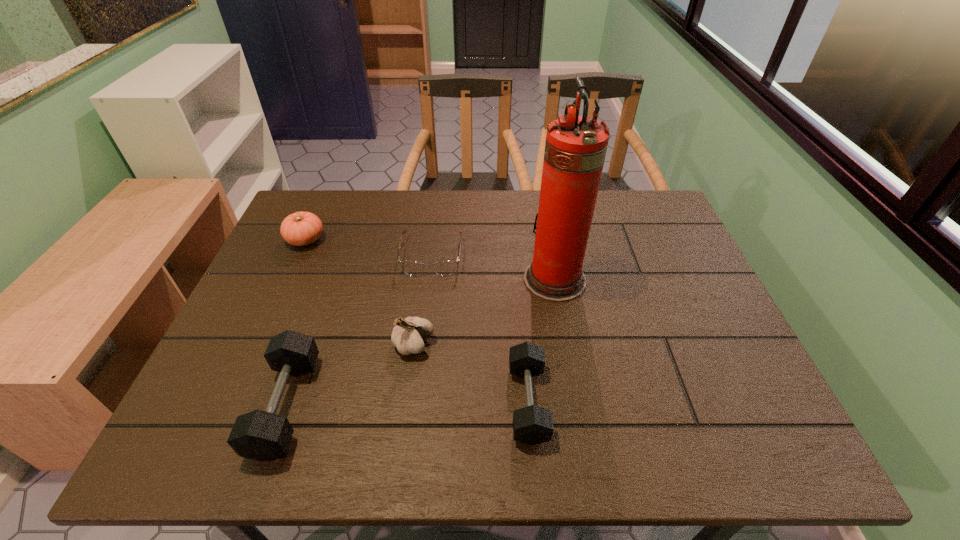
The image size is (960, 540). In order to click on vacant point located between the right dumbbell and the left dumbbell in this screenshot , I will do `click(407, 403)`.

You are a GUI agent. You are given a task and a screenshot of the screen. Output one action in this format:
    pyautogui.click(x=<x>, y=<y>)
    Task: Click on the blank region between the tomato and the tallest object
    The image size is (960, 540).
    Given the screenshot: What is the action you would take?
    pyautogui.click(x=430, y=260)

Where is `free space between the tallest object and the shortest object`? The image size is (960, 540). free space between the tallest object and the shortest object is located at coordinates (493, 268).

Locate an element on the screen. the third closest object to the garlic is located at coordinates (444, 268).

Identify the location of the fifth closest object relative to the shorter dumbbell. pyautogui.click(x=301, y=228).

Where is `vacant region that satisfies the following two spatial constraints: 1. on the front-facing side of the right dumbbell; 2. on the left side of the spectacles`? The width and height of the screenshot is (960, 540). vacant region that satisfies the following two spatial constraints: 1. on the front-facing side of the right dumbbell; 2. on the left side of the spectacles is located at coordinates (414, 402).

This screenshot has width=960, height=540. What are the coordinates of `free space that satisfies the following two spatial constraints: 1. at the discharge end of the tallest object; 2. on the front side of the garlic` in the screenshot? It's located at coord(565,344).

Locate an element on the screen. vacant space that satisfies the following two spatial constraints: 1. at the discharge end of the fire extinguisher; 2. on the front side of the taller dumbbell is located at coordinates click(x=576, y=405).